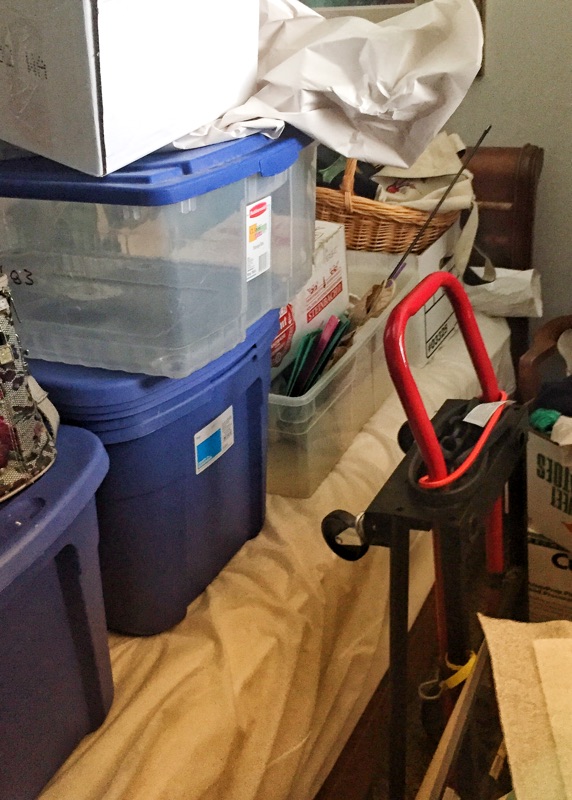
Where is `small supportive dolly red handle`? This screenshot has width=572, height=800. small supportive dolly red handle is located at coordinates (422, 296).